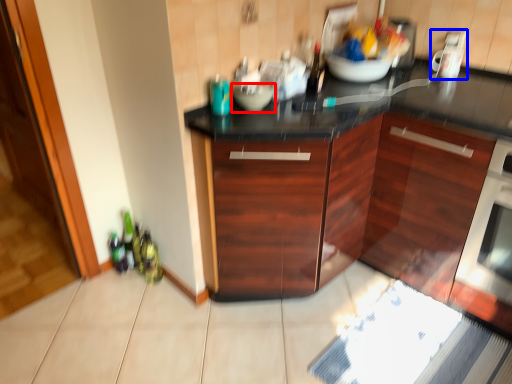
Question: Which point is further to the camera, bowl (highlighted by a red box) or appliance (highlighted by a blue box)?

Choices:
 (A) bowl
 (B) appliance

Answer: (B)